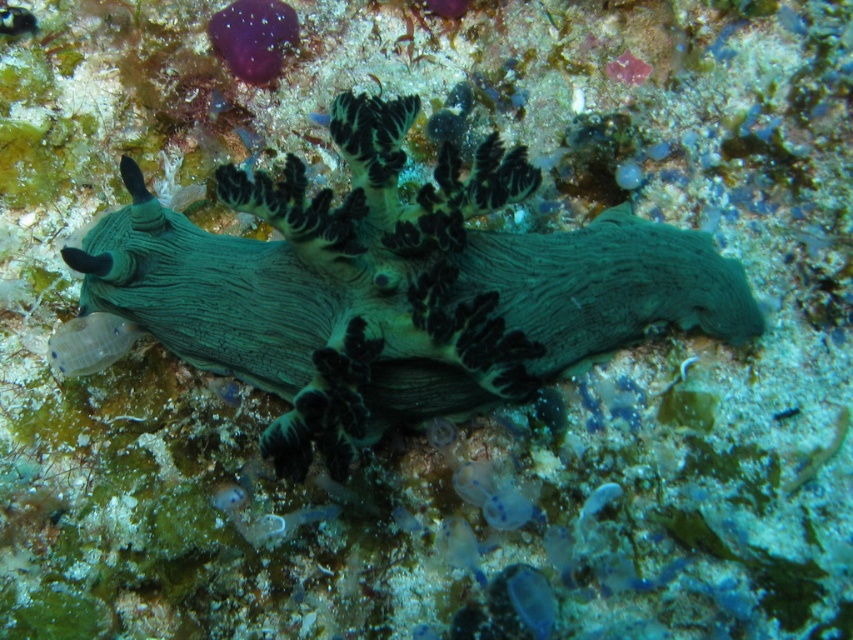
Which is in front, point (701, 278) or point (309, 115)?

Positioned in front is point (701, 278).

This screenshot has height=640, width=853. I want to click on green rubbery sea slug at center, so click(x=395, y=285).

I want to click on green rubbery sea slug at center, so click(395, 285).

Looking at this image, can you confirm if purple rubbery sponge at upper center is smaller than translucent gelatinous at left?

No.

Locate an element on the screen. The height and width of the screenshot is (640, 853). purple rubbery sponge at upper center is located at coordinates (253, 36).

Between translucent gelatinous at left and translucent blue jellyfish at center, which one appears on the right side from the viewer's perspective?

translucent blue jellyfish at center is more to the right.

Is translucent gelatinous at left bigger than translucent blue jellyfish at center?

Correct, translucent gelatinous at left is larger in size than translucent blue jellyfish at center.

Between point (74, 356) and point (483, 515), which one is positioned behind?

Positioned behind is point (74, 356).

At what (x,y) coordinates should I click in order to perform the action: click on translucent gelatinous at left. Please return your answer as a coordinate pair (x, y). This screenshot has height=640, width=853. Looking at the image, I should click on (90, 342).